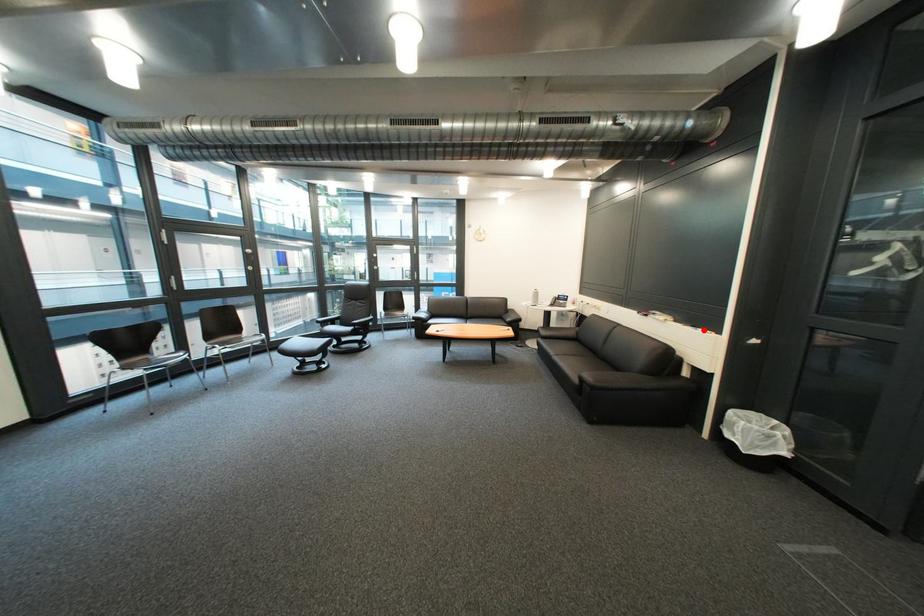
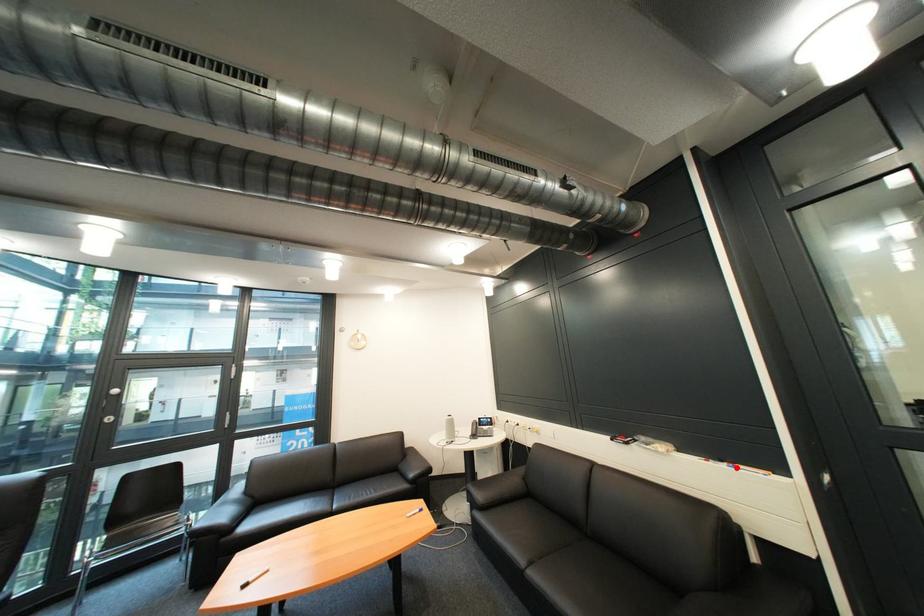
I am providing you with two images of the same scene from different viewpoints. A red point is marked on the first image and another point is marked on the second image. Does the point marked in image1 correspond to the same location as the one in image2?

Yes